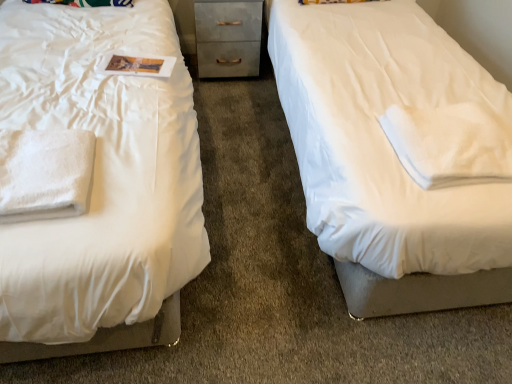
Question: From the image's perspective, is white soft towel at left, placed as the second cloth when sorted from right to left, on top of white soft cloth at right, which is the second cloth in left-to-right order?

Choices:
 (A) yes
 (B) no

Answer: (B)

Question: Does white soft towel at left, marked as the 1th cloth in a left-to-right arrangement, have a lesser width compared to white soft cloth at right, which is the second cloth in left-to-right order?

Choices:
 (A) no
 (B) yes

Answer: (B)

Question: Is white soft towel at left, marked as the 1th cloth in a left-to-right arrangement, taller than white soft cloth at right, which is the second cloth in left-to-right order?

Choices:
 (A) yes
 (B) no

Answer: (A)

Question: From the image's perspective, does white soft towel at left, placed as the second cloth when sorted from right to left, appear lower than white soft cloth at right, arranged as the first cloth when viewed from the right?

Choices:
 (A) yes
 (B) no

Answer: (A)

Question: Does white soft towel at left, marked as the 1th cloth in a left-to-right arrangement, lie behind white soft cloth at right, arranged as the first cloth when viewed from the right?

Choices:
 (A) yes
 (B) no

Answer: (B)

Question: Would you say white soft cloth at right, arranged as the first cloth when viewed from the right, is part of white soft towel at left, placed as the second cloth when sorted from right to left,'s contents?

Choices:
 (A) no
 (B) yes

Answer: (A)

Question: Can you confirm if metallic gray chest of drawers at center is taller than white soft towel at left, marked as the 1th cloth in a left-to-right arrangement?

Choices:
 (A) yes
 (B) no

Answer: (A)

Question: Is metallic gray chest of drawers at center oriented towards white soft towel at left, marked as the 1th cloth in a left-to-right arrangement?

Choices:
 (A) no
 (B) yes

Answer: (B)

Question: From the image's perspective, is metallic gray chest of drawers at center above white soft towel at left, placed as the second cloth when sorted from right to left?

Choices:
 (A) no
 (B) yes

Answer: (B)

Question: Considering the relative sizes of metallic gray chest of drawers at center and white soft towel at left, marked as the 1th cloth in a left-to-right arrangement, in the image provided, is metallic gray chest of drawers at center bigger than white soft towel at left, marked as the 1th cloth in a left-to-right arrangement,?

Choices:
 (A) yes
 (B) no

Answer: (A)

Question: Is metallic gray chest of drawers at center located outside white soft towel at left, placed as the second cloth when sorted from right to left?

Choices:
 (A) no
 (B) yes

Answer: (B)

Question: Is metallic gray chest of drawers at center smaller than white soft towel at left, marked as the 1th cloth in a left-to-right arrangement?

Choices:
 (A) no
 (B) yes

Answer: (A)

Question: Does white soft cloth at right, arranged as the first cloth when viewed from the right, have a greater height compared to white soft towel at left, placed as the second cloth when sorted from right to left?

Choices:
 (A) no
 (B) yes

Answer: (A)